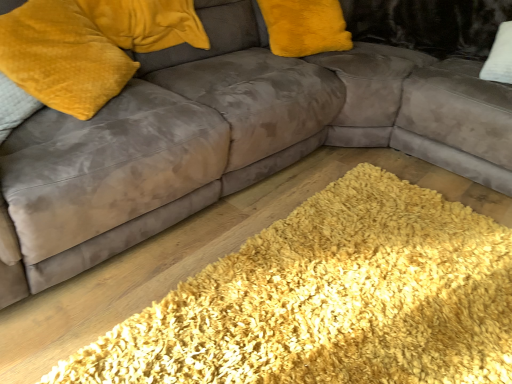
Question: From a real-world perspective, relative to shaggy yellow rug at lower center, is velvet yellow pillow at upper left vertically above or below?

Choices:
 (A) above
 (B) below

Answer: (A)

Question: Looking at the image, does velvet yellow pillow at upper left seem bigger or smaller compared to shaggy yellow rug at lower center?

Choices:
 (A) small
 (B) big

Answer: (A)

Question: Is velvet yellow pillow at upper left to the left or to the right of shaggy yellow rug at lower center in the image?

Choices:
 (A) right
 (B) left

Answer: (B)

Question: Based on their sizes in the image, would you say shaggy yellow rug at lower center is bigger or smaller than velvet yellow pillow at upper left?

Choices:
 (A) big
 (B) small

Answer: (A)

Question: Considering the relative positions of shaggy yellow rug at lower center and velvet yellow pillow at upper left in the image provided, is shaggy yellow rug at lower center to the left or to the right of velvet yellow pillow at upper left?

Choices:
 (A) left
 (B) right

Answer: (B)

Question: Would you say shaggy yellow rug at lower center is inside or outside velvet yellow pillow at upper left?

Choices:
 (A) outside
 (B) inside

Answer: (A)

Question: Considering the positions of point (164, 375) and point (66, 66), is point (164, 375) closer or farther from the camera than point (66, 66)?

Choices:
 (A) closer
 (B) farther

Answer: (A)